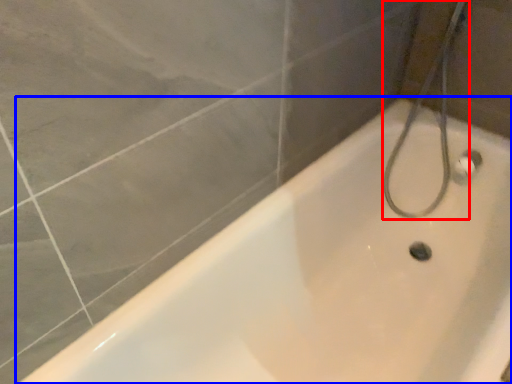
Question: Among these objects, which one is nearest to the camera, shower (highlighted by a red box) or bathtub (highlighted by a blue box)?

Choices:
 (A) shower
 (B) bathtub

Answer: (B)